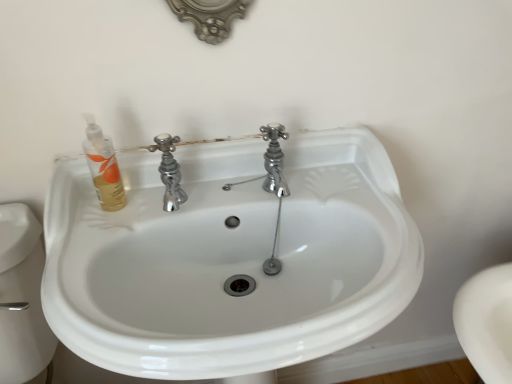
Question: From the image's perspective, relative to white glossy sink at center, is translucent gold liquid soap at upper left above or below?

Choices:
 (A) above
 (B) below

Answer: (A)

Question: Is translucent gold liquid soap at upper left inside or outside of white glossy sink at center?

Choices:
 (A) outside
 (B) inside

Answer: (B)

Question: Looking at the image, does translucent gold liquid soap at upper left seem bigger or smaller compared to white glossy sink at center?

Choices:
 (A) small
 (B) big

Answer: (A)

Question: Is white glossy sink at center inside or outside of translucent gold liquid soap at upper left?

Choices:
 (A) outside
 (B) inside

Answer: (A)

Question: Considering the positions of point (115, 324) and point (103, 203), is point (115, 324) closer or farther from the camera than point (103, 203)?

Choices:
 (A) closer
 (B) farther

Answer: (A)

Question: Is white glossy sink at center wider or thinner than translucent gold liquid soap at upper left?

Choices:
 (A) thin
 (B) wide

Answer: (B)

Question: Considering their positions, is white glossy sink at center located in front of or behind translucent gold liquid soap at upper left?

Choices:
 (A) front
 (B) behind

Answer: (A)